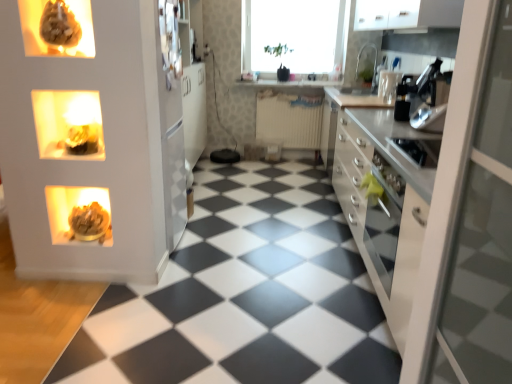
Question: Considering the relative sizes of matte brown sculpture at upper left, which is the third appliance in bottom-to-top order, and matte gold sculpture at left, placed as the 4th appliance when sorted from right to left, in the image provided, is matte brown sculpture at upper left, which is the third appliance in bottom-to-top order, wider than matte gold sculpture at left, placed as the 4th appliance when sorted from right to left,?

Choices:
 (A) yes
 (B) no

Answer: (B)

Question: From the image's perspective, is matte brown sculpture at upper left, placed as the 1th appliance when sorted from front to back, below matte gold sculpture at left, positioned as the second appliance in front-to-back order?

Choices:
 (A) yes
 (B) no

Answer: (B)

Question: Is matte brown sculpture at upper left, placed as the 4th appliance when sorted from back to front, directly adjacent to matte gold sculpture at left, which appears as the 4th appliance when viewed from the top?

Choices:
 (A) no
 (B) yes

Answer: (A)

Question: Does matte brown sculpture at upper left, which is the third appliance in bottom-to-top order, have a smaller size compared to matte gold sculpture at left, the 1th appliance positioned from the bottom?

Choices:
 (A) no
 (B) yes

Answer: (B)

Question: Can you confirm if matte brown sculpture at upper left, placed as the 4th appliance when sorted from back to front, is positioned to the right of matte gold sculpture at left, the 3th appliance positioned from the back?

Choices:
 (A) no
 (B) yes

Answer: (B)

Question: From a real-world perspective, is white matte cabinet at upper right positioned above or below satin white countertop at right?

Choices:
 (A) above
 (B) below

Answer: (A)

Question: Considering the positions of white matte cabinet at upper right and satin white countertop at right in the image, is white matte cabinet at upper right taller or shorter than satin white countertop at right?

Choices:
 (A) short
 (B) tall

Answer: (A)

Question: Which is correct: white matte cabinet at upper right is inside satin white countertop at right, or outside of it?

Choices:
 (A) inside
 (B) outside

Answer: (B)

Question: Considering the positions of point (460, 3) and point (390, 152), is point (460, 3) closer or farther from the camera than point (390, 152)?

Choices:
 (A) closer
 (B) farther

Answer: (B)

Question: Considering the positions of black rubber tile at center and matte brown sculpture at upper left, acting as the second appliance starting from the left, in the image, is black rubber tile at center taller or shorter than matte brown sculpture at upper left, acting as the second appliance starting from the left,?

Choices:
 (A) tall
 (B) short

Answer: (B)

Question: Based on their positions, is black rubber tile at center located to the left or right of matte brown sculpture at upper left, which ranks as the second appliance in top-to-bottom order?

Choices:
 (A) left
 (B) right

Answer: (B)

Question: From the image's perspective, is black rubber tile at center above or below matte brown sculpture at upper left, placed as the third appliance when sorted from right to left?

Choices:
 (A) below
 (B) above

Answer: (A)

Question: Considering the positions of point (271, 271) and point (68, 24), is point (271, 271) closer or farther from the camera than point (68, 24)?

Choices:
 (A) farther
 (B) closer

Answer: (A)

Question: Do you think black plastic coffee maker at upper right, the 2th appliance when ordered from back to front, is within white glossy countertop at center, or outside of it?

Choices:
 (A) inside
 (B) outside

Answer: (B)

Question: Is point (403, 107) closer or farther from the camera than point (249, 82)?

Choices:
 (A) farther
 (B) closer

Answer: (B)